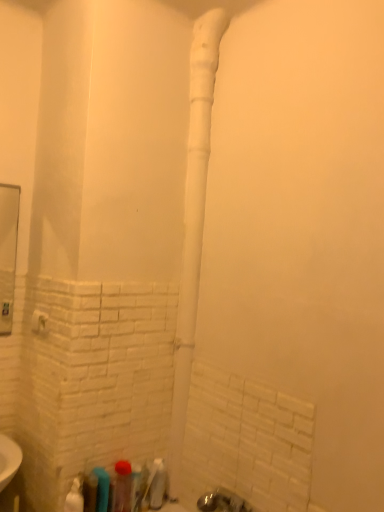
Question: Does translucent plastic bottle at lower center, which is the fourth toiletry from left to right, have a smaller size compared to translucent plastic bottle at lower left, which is the fifth toiletry from right to left?

Choices:
 (A) no
 (B) yes

Answer: (A)

Question: From the image's perspective, is translucent plastic bottle at lower center, which is the fourth toiletry from left to right, on translucent plastic bottle at lower left, which is the fifth toiletry from right to left?

Choices:
 (A) no
 (B) yes

Answer: (B)

Question: Is translucent plastic bottle at lower center, the third toiletry from the right, not inside translucent plastic bottle at lower left, which is the fifth toiletry from right to left?

Choices:
 (A) yes
 (B) no

Answer: (A)

Question: Does translucent plastic bottle at lower center, which is the fourth toiletry from left to right, have a greater width compared to translucent plastic bottle at lower left, which is the fifth toiletry from right to left?

Choices:
 (A) yes
 (B) no

Answer: (B)

Question: Can you confirm if translucent plastic bottle at lower center, the third toiletry from the right, is thinner than translucent plastic bottle at lower left, which is counted as the second toiletry, starting from the left?

Choices:
 (A) yes
 (B) no

Answer: (A)

Question: From the image's perspective, would you say translucent plastic bottle at lower center, which is the fourth toiletry from left to right, is shown under translucent plastic bottle at lower left, which is counted as the second toiletry, starting from the left?

Choices:
 (A) yes
 (B) no

Answer: (B)

Question: Considering the relative sizes of translucent plastic bottle at lower left, which is the fifth toiletry from right to left, and translucent plastic bottle at lower center, which is the fourth toiletry from left to right, in the image provided, is translucent plastic bottle at lower left, which is the fifth toiletry from right to left, shorter than translucent plastic bottle at lower center, which is the fourth toiletry from left to right,?

Choices:
 (A) no
 (B) yes

Answer: (A)

Question: Can you confirm if translucent plastic bottle at lower left, which is counted as the second toiletry, starting from the left, is taller than translucent plastic bottle at lower center, which is the fourth toiletry from left to right?

Choices:
 (A) no
 (B) yes

Answer: (B)

Question: Would you say translucent plastic bottle at lower left, which is the fifth toiletry from right to left, contains translucent plastic bottle at lower center, the third toiletry from the right?

Choices:
 (A) yes
 (B) no

Answer: (B)

Question: Does translucent plastic bottle at lower left, which is the fifth toiletry from right to left, have a greater width compared to translucent plastic bottle at lower center, which is the fourth toiletry from left to right?

Choices:
 (A) yes
 (B) no

Answer: (A)

Question: Is translucent plastic bottle at lower left, which is counted as the second toiletry, starting from the left, next to translucent plastic bottle at lower center, the third toiletry from the right, and touching it?

Choices:
 (A) no
 (B) yes

Answer: (A)

Question: Does translucent plastic bottle at lower left, which is counted as the second toiletry, starting from the left, appear on the right side of translucent plastic bottle at lower center, the third toiletry from the right?

Choices:
 (A) yes
 (B) no

Answer: (B)

Question: Does white plastic pipe at center have a greater height compared to translucent plastic bottle at lower left, the 4th toiletry when ordered from right to left?

Choices:
 (A) no
 (B) yes

Answer: (B)